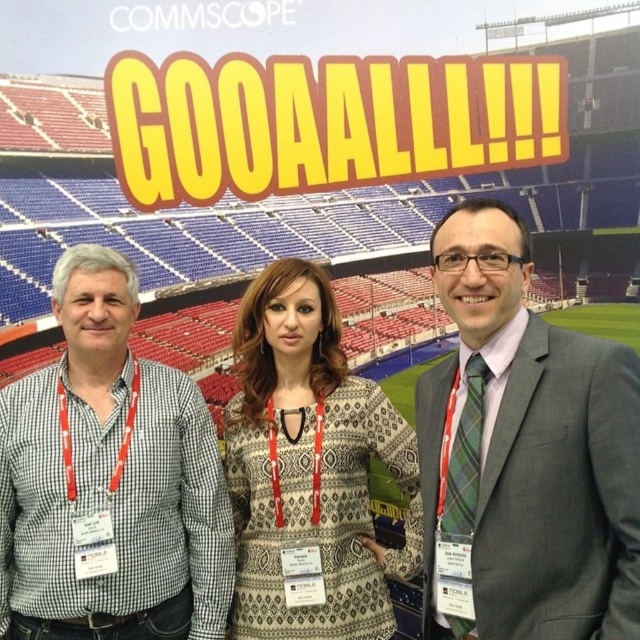
Question: Among these points, which one is nearest to the camera?

Choices:
 (A) (385, 621)
 (B) (628, 508)

Answer: (B)

Question: Is checkered fabric shirt at left to the right of patterned fabric dress at center from the viewer's perspective?

Choices:
 (A) yes
 (B) no

Answer: (B)

Question: Does checkered fabric shirt at left have a greater width compared to patterned fabric dress at center?

Choices:
 (A) no
 (B) yes

Answer: (B)

Question: Which point appears farthest from the camera in this image?

Choices:
 (A) (131, 577)
 (B) (541, 460)
 (C) (371, 627)

Answer: (C)

Question: Among these points, which one is nearest to the camera?

Choices:
 (A) coord(28,536)
 (B) coord(621,611)
 (C) coord(284,566)

Answer: (B)

Question: Is checkered fabric shirt at left below patterned fabric dress at center?

Choices:
 (A) no
 (B) yes

Answer: (A)